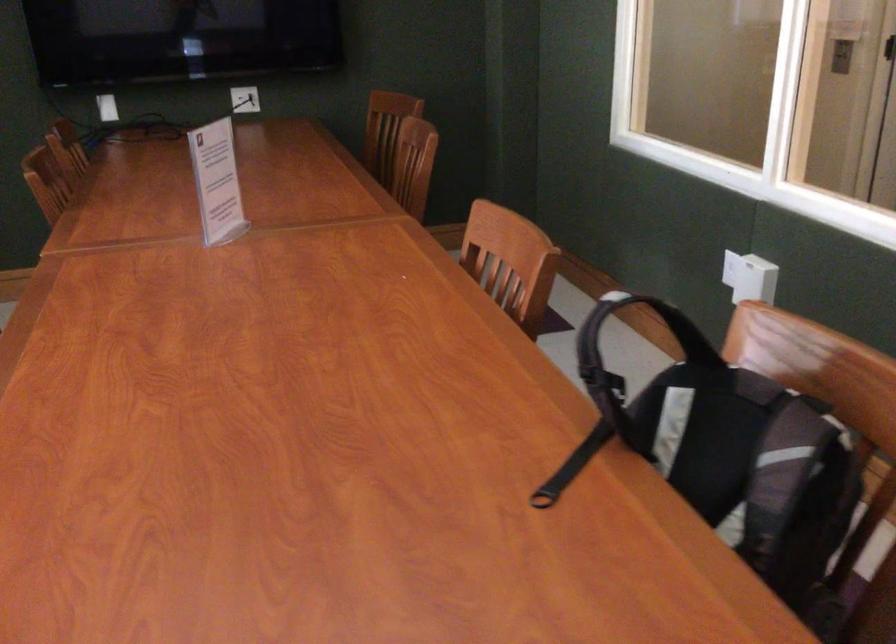
Locate an element on the screen. The height and width of the screenshot is (644, 896). backpack strap is located at coordinates (796, 456).